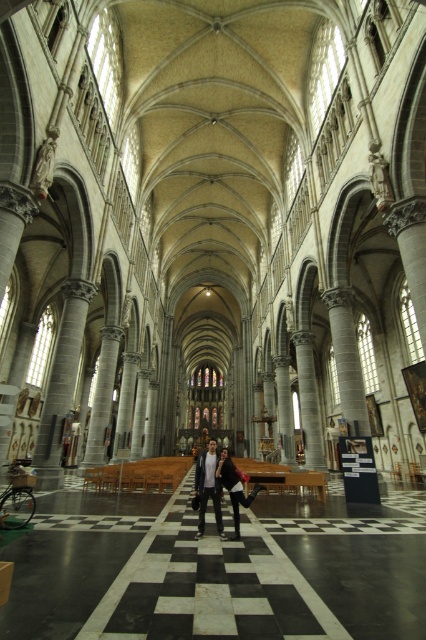
Does matte black jacket at center have a lesser height compared to white shirt at center?

No.

Can you confirm if matte black jacket at center is thinner than white shirt at center?

In fact, matte black jacket at center might be wider than white shirt at center.

The width and height of the screenshot is (426, 640). Describe the element at coordinates (221, 486) in the screenshot. I see `matte black jacket at center` at that location.

This screenshot has width=426, height=640. I want to click on matte black jacket at center, so click(x=221, y=486).